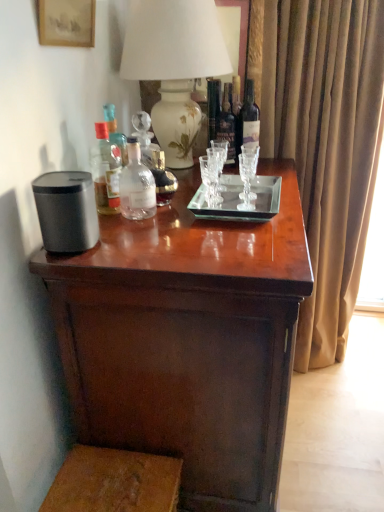
Question: Which direction should I rotate to face dark glass bottle at center, marked as the 2th bottle in a right-to-left arrangement, — up or down?

Choices:
 (A) down
 (B) up

Answer: (B)

Question: Can you see wooden step stool at lower left touching brown velvet curtain at right?

Choices:
 (A) no
 (B) yes

Answer: (A)

Question: Is wooden step stool at lower left thinner than brown velvet curtain at right?

Choices:
 (A) yes
 (B) no

Answer: (A)

Question: From a real-world perspective, is wooden step stool at lower left located beneath brown velvet curtain at right?

Choices:
 (A) no
 (B) yes

Answer: (B)

Question: Does wooden step stool at lower left have a smaller size compared to brown velvet curtain at right?

Choices:
 (A) no
 (B) yes

Answer: (B)

Question: Could you tell me if wooden step stool at lower left is turned towards brown velvet curtain at right?

Choices:
 (A) yes
 (B) no

Answer: (B)

Question: From the image's perspective, is wooden step stool at lower left above brown velvet curtain at right?

Choices:
 (A) yes
 (B) no

Answer: (B)

Question: Considering the relative positions of dark wood table at center and translucent glass bottle at upper left, arranged as the first bottle when viewed from the left, in the image provided, is dark wood table at center in front of translucent glass bottle at upper left, arranged as the first bottle when viewed from the left,?

Choices:
 (A) yes
 (B) no

Answer: (A)

Question: Is translucent glass bottle at upper left, arranged as the first bottle when viewed from the left, completely or partially inside dark wood table at center?

Choices:
 (A) yes
 (B) no

Answer: (B)

Question: Does dark wood table at center have a lesser height compared to translucent glass bottle at upper left, arranged as the first bottle when viewed from the left?

Choices:
 (A) no
 (B) yes

Answer: (A)

Question: From a real-world perspective, is dark wood table at center positioned under translucent glass bottle at upper left, positioned as the fifth bottle in right-to-left order, based on gravity?

Choices:
 (A) yes
 (B) no

Answer: (A)

Question: Could you tell me if dark wood table at center is facing translucent glass bottle at upper left, arranged as the first bottle when viewed from the left?

Choices:
 (A) yes
 (B) no

Answer: (B)

Question: Is dark wood table at center at the left side of translucent glass bottle at upper left, arranged as the first bottle when viewed from the left?

Choices:
 (A) no
 (B) yes

Answer: (A)

Question: Does dark glass bottle at center, which ranks as the fourth bottle in left-to-right order, appear on the left side of transparent glass tray at center?

Choices:
 (A) yes
 (B) no

Answer: (B)